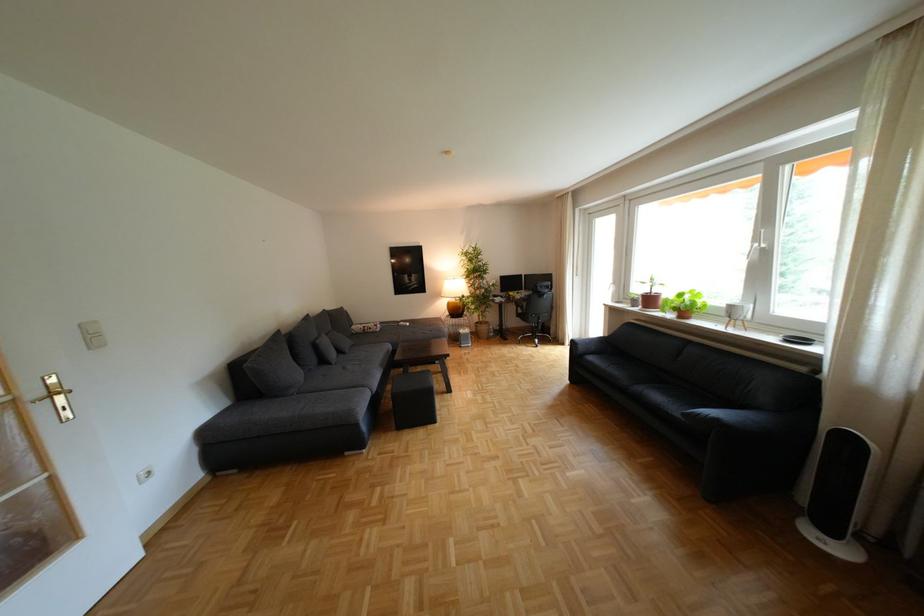
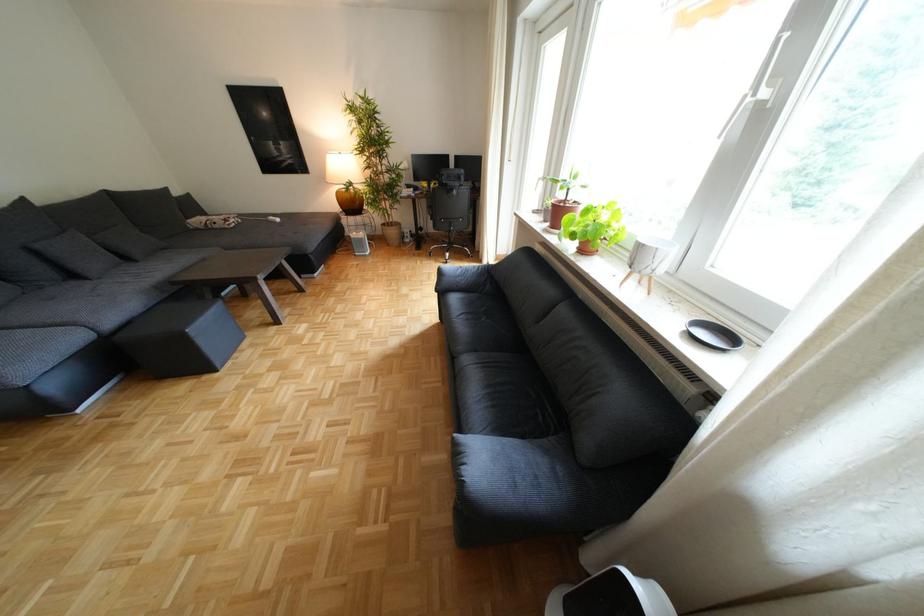
Where in the second image is the point corresponding to the point at 646,306 from the first image?

(558, 220)